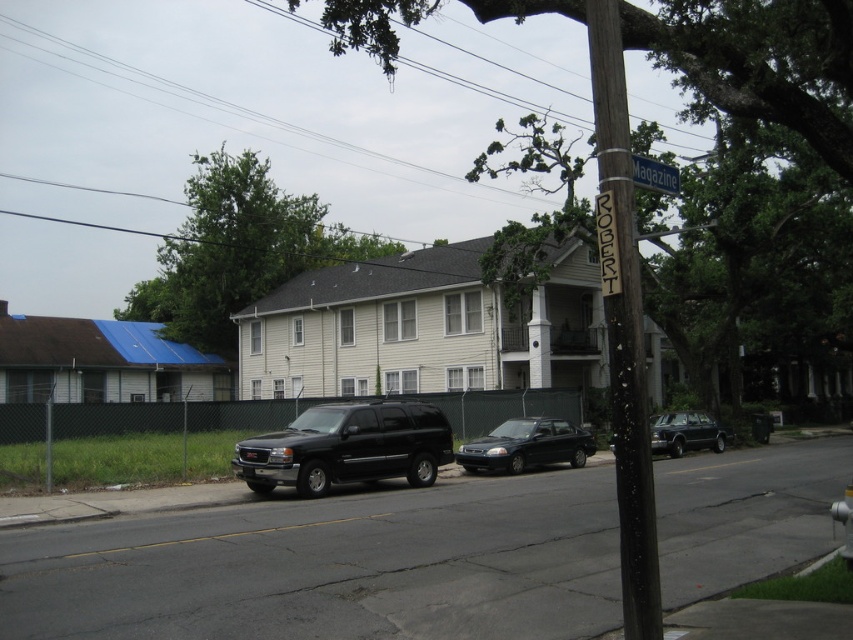
You are a pedestrian standing on the sidewalk and want to cross the street. You see the black matte suv at center and the green metallic street sign at upper center. Which object is higher from the ground?

The green metallic street sign at upper center is higher from the ground than the black matte suv at center because it is positioned above it.

You are a delivery driver who needs to park your truck between the dark brown wooden telegraph pole at center and the green metallic street sign at upper center. Can you fit your truck there without blocking the street sign?

The dark brown wooden telegraph pole at center is in front of the green metallic street sign at upper center, meaning there is space between them where the truck can be parked without blocking the sign.